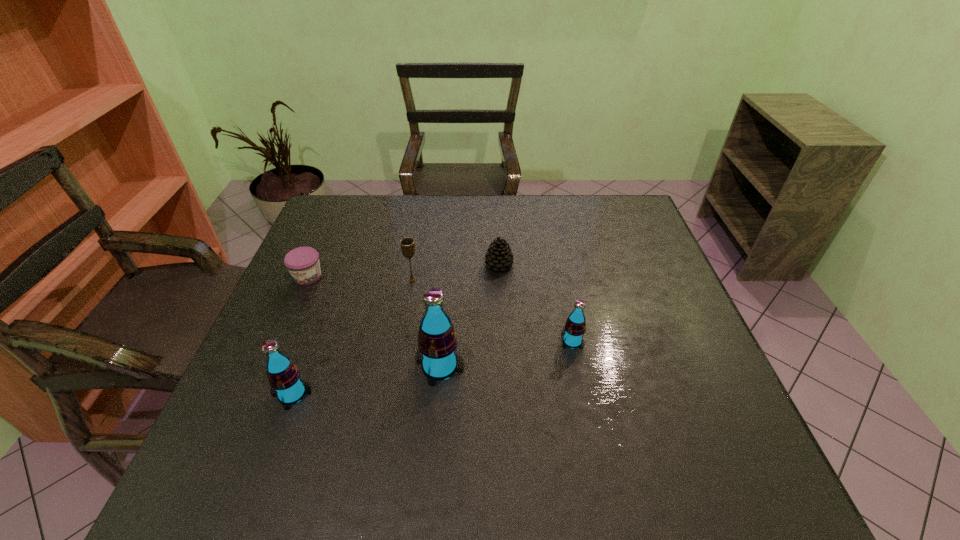
Image resolution: width=960 pixels, height=540 pixels. What are the coordinates of `free spot that satisfies the following two spatial constraints: 1. on the front label of the jam; 2. on the right side of the shortest soda` in the screenshot? It's located at (280, 341).

Identify the location of free space that satisfies the following two spatial constraints: 1. on the front label of the shortest object; 2. on the left side of the shortest soda. The height and width of the screenshot is (540, 960). (280, 341).

Identify the location of free location that satisfies the following two spatial constraints: 1. at the narrow end of the pinecone; 2. on the front side of the leftmost soda. (505, 394).

Where is `blank space that satisfies the following two spatial constraints: 1. on the front label of the leftmost soda; 2. on the left side of the jam`? The height and width of the screenshot is (540, 960). blank space that satisfies the following two spatial constraints: 1. on the front label of the leftmost soda; 2. on the left side of the jam is located at coordinates (257, 394).

Locate an element on the screen. The height and width of the screenshot is (540, 960). vacant region that satisfies the following two spatial constraints: 1. at the narrow end of the pinecone; 2. on the front label of the shortest object is located at coordinates (499, 276).

At what (x,y) coordinates should I click in order to perform the action: click on free spot that satisfies the following two spatial constraints: 1. on the back side of the shortest soda; 2. on the left side of the second soda from left to right. Please return your answer as a coordinate pair (x, y). Looking at the image, I should click on (442, 341).